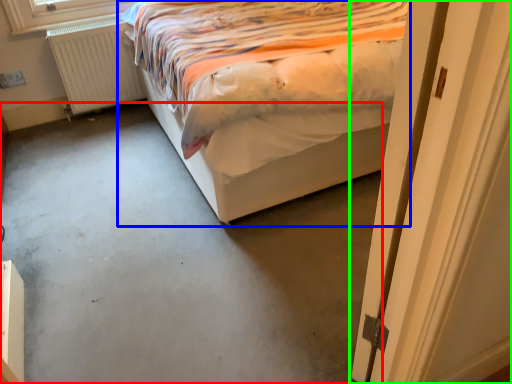
Question: Which is farther away from concrete (highlighted by a red box)? bed (highlighted by a blue box) or door (highlighted by a green box)?

Choices:
 (A) bed
 (B) door

Answer: (B)